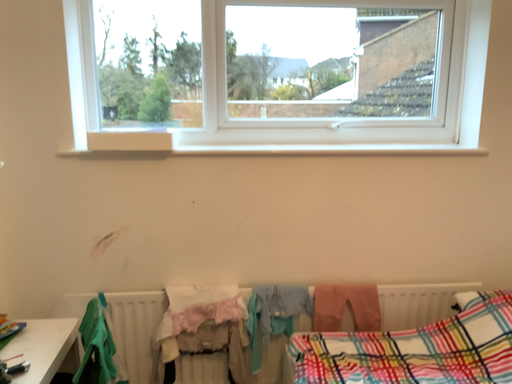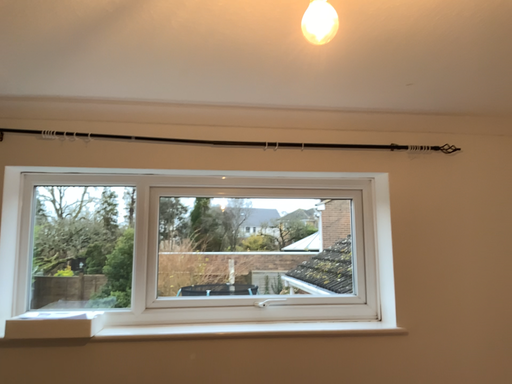
Question: How did the camera likely rotate when shooting the video?

Choices:
 (A) rotated downward
 (B) rotated upward

Answer: (B)